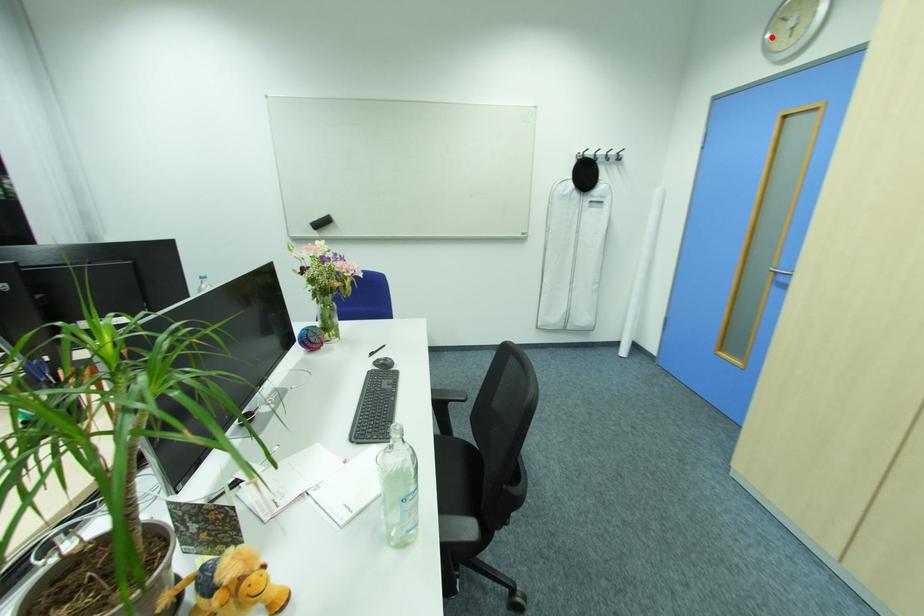
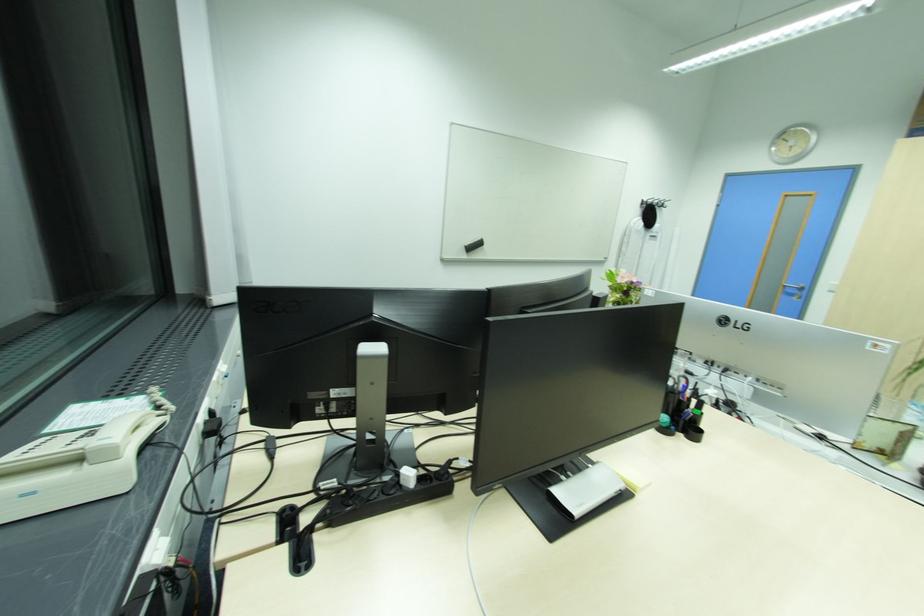
Locate, in the second image, the point that corresponds to the highlighted location in the first image.

(779, 148)